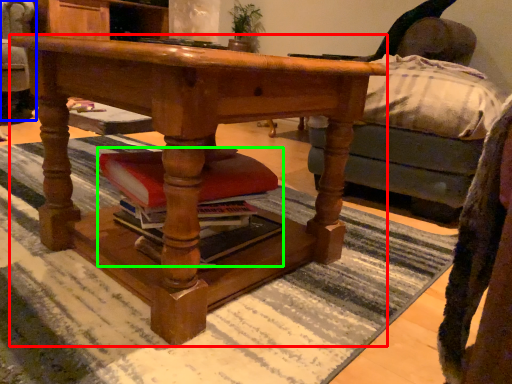
Question: Which is nearer to the desk (highlighted by a red box)? swivel chair (highlighted by a blue box) or book (highlighted by a green box).

Choices:
 (A) swivel chair
 (B) book

Answer: (B)